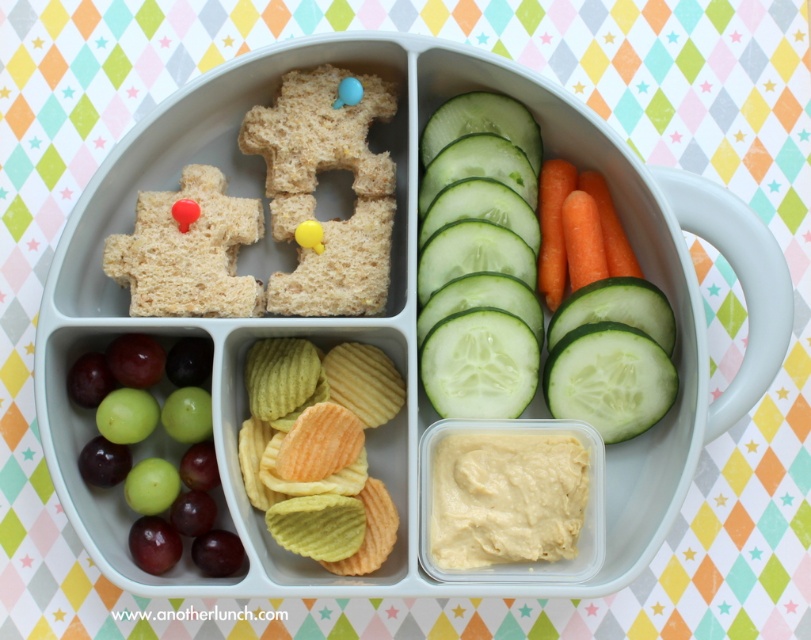
Between point (603, 337) and point (136, 493), which one is positioned in front?

Point (136, 493)

Does green smooth cucumber at right lie behind green matte grapes at lower left?

Yes, it is behind green matte grapes at lower left.

Find the location of `green smooth cucumber at right`. green smooth cucumber at right is located at coordinates (534, 278).

You are a GUI agent. You are given a task and a screenshot of the screen. Output one action in this format:
    pyautogui.click(x=<x>, y=<y>)
    Task: Click on the green smooth cucumber at right
    This screenshot has width=811, height=640.
    Given the screenshot: What is the action you would take?
    pyautogui.click(x=534, y=278)

Between green smooth cucumber at center and green smooth cucumber at center right, which one appears on the right side from the viewer's perspective?

green smooth cucumber at center right

Is green smooth cucumber at center bigger than green smooth cucumber at center right?

Yes, green smooth cucumber at center is bigger than green smooth cucumber at center right.

Where is `green smooth cucumber at center`? The width and height of the screenshot is (811, 640). green smooth cucumber at center is located at coordinates (479, 257).

Between green smooth cucumber at right and green ridged chips at center, which one is positioned lower?

green ridged chips at center is lower down.

Which is more to the right, green smooth cucumber at right or green ridged chips at center?

Positioned to the right is green smooth cucumber at right.

Does point (644, 401) come farther from viewer compared to point (391, 531)?

Yes, it is.

This screenshot has height=640, width=811. I want to click on green smooth cucumber at right, so click(x=534, y=278).